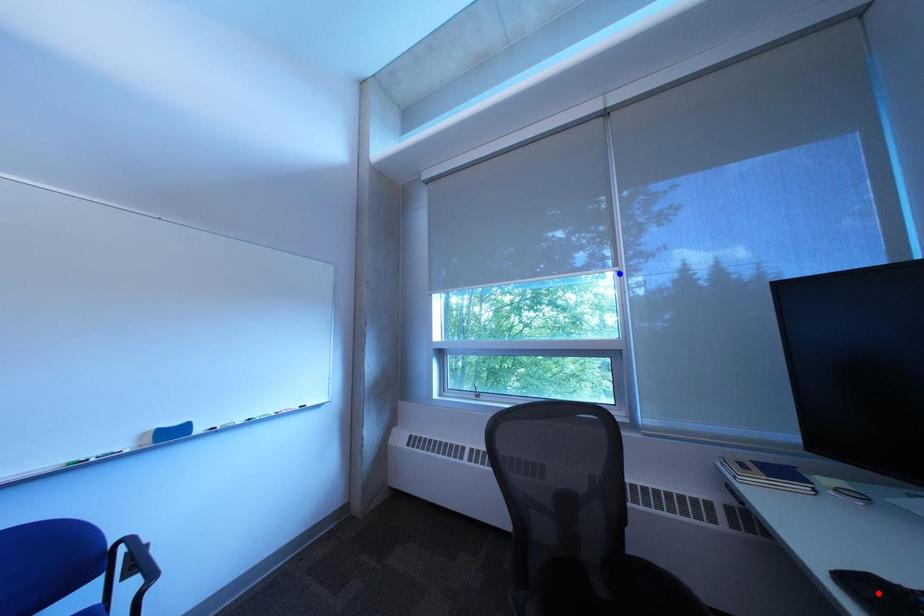
Question: Two points are marked on the image. Which point is closer to the camera?

Choices:
 (A) Blue point is closer.
 (B) Red point is closer.

Answer: (B)